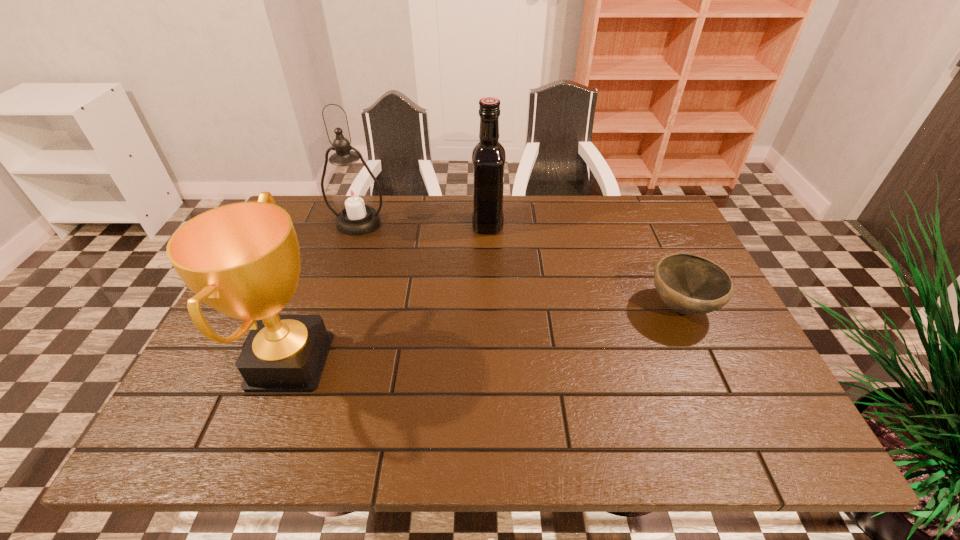
Image resolution: width=960 pixels, height=540 pixels. In order to click on vacant space located on the left of the rightmost object in this screenshot , I will do `click(515, 307)`.

Find the location of a particular element. This screenshot has height=540, width=960. liquor that is at the far edge is located at coordinates (488, 156).

You are a GUI agent. You are given a task and a screenshot of the screen. Output one action in this format:
    pyautogui.click(x=<x>, y=<y>)
    Task: Click on the oil lamp present at the far edge
    
    Given the screenshot: What is the action you would take?
    pyautogui.click(x=352, y=194)

Locate an element on the screen. Image resolution: width=960 pixels, height=540 pixels. object situated at the near edge is located at coordinates (242, 259).

The height and width of the screenshot is (540, 960). What are the coordinates of `oil lamp located at the left edge` in the screenshot? It's located at (352, 194).

The image size is (960, 540). I want to click on award located at the left edge, so click(242, 259).

The height and width of the screenshot is (540, 960). I want to click on object situated at the right edge, so click(x=688, y=284).

The image size is (960, 540). Find the location of `object located at the far left corner`. object located at the far left corner is located at coordinates (352, 194).

You are a GUI agent. You are given a task and a screenshot of the screen. Output one action in this format:
    pyautogui.click(x=<x>, y=<y>)
    Task: Click on the object at the near left corner
    This screenshot has width=960, height=540.
    Given the screenshot: What is the action you would take?
    pyautogui.click(x=242, y=259)

In the image, there is a desktop. Where is `free space at the far edge`? This screenshot has width=960, height=540. free space at the far edge is located at coordinates (479, 241).